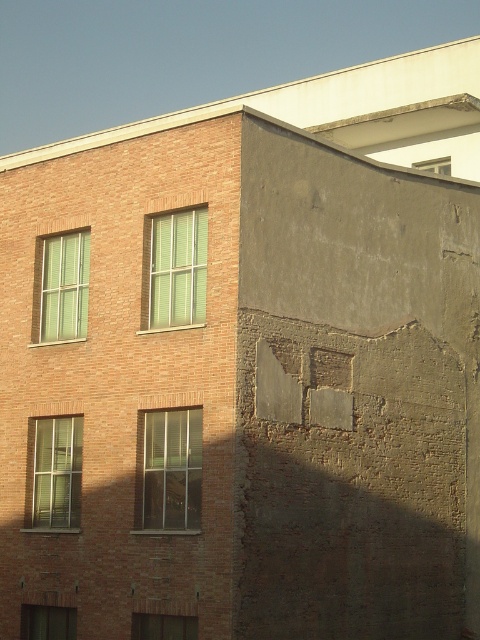
Question: Which is nearer to the clear glass window at center?

Choices:
 (A) clear glass window at upper right
 (B) clear glass window at lower left
 (C) green matte window at upper left
 (D) matte brown wooden window at lower center

Answer: (D)

Question: Can you confirm if clear glass window at center is positioned to the left of matte glass window at lower left?

Choices:
 (A) no
 (B) yes

Answer: (A)

Question: Based on their relative distances, which object is nearer to the clear glass window at lower left?

Choices:
 (A) clear glass window at center
 (B) matte glass window at lower left
 (C) green matte window at upper left

Answer: (B)

Question: Considering the real-world distances, which object is closest to the green matte window at center?

Choices:
 (A) matte glass window at lower left
 (B) green matte window at upper left
 (C) clear glass window at center

Answer: (C)

Question: Does clear glass window at lower left have a larger size compared to clear glass window at upper right?

Choices:
 (A) no
 (B) yes

Answer: (B)

Question: Is clear glass window at center further to camera compared to green matte window at center?

Choices:
 (A) yes
 (B) no

Answer: (B)